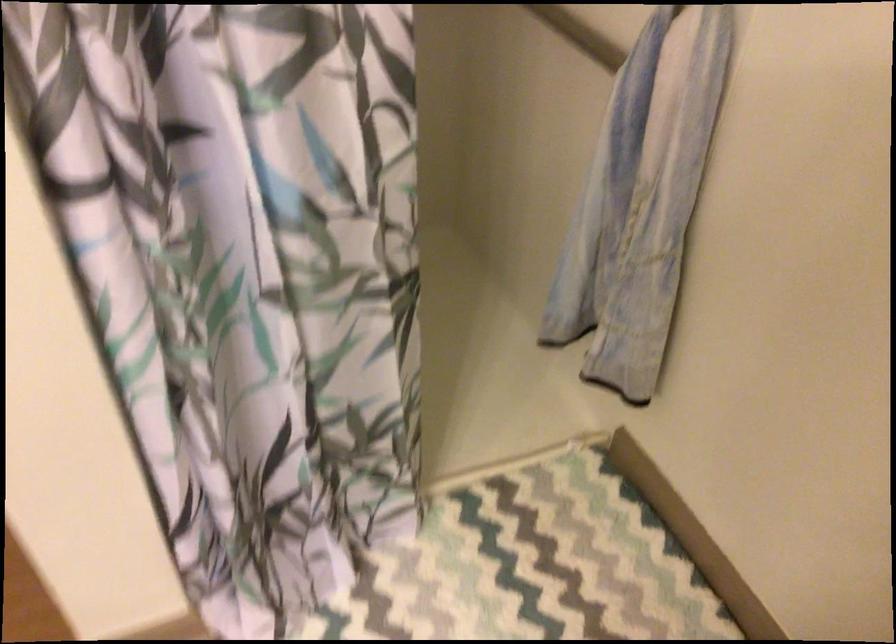
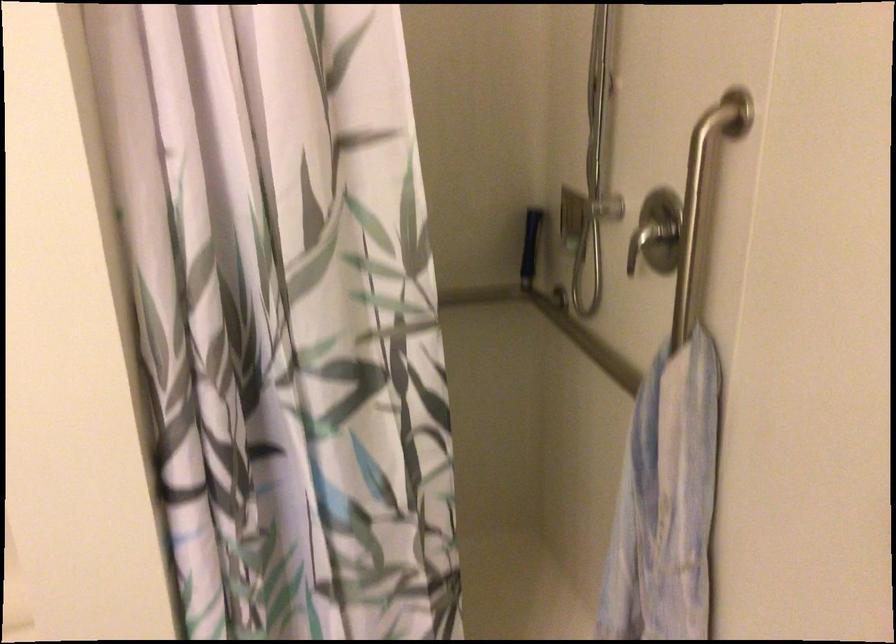
Question: How did the camera likely rotate?

Choices:
 (A) Left
 (B) Right
 (C) Up
 (D) Down

Answer: (C)